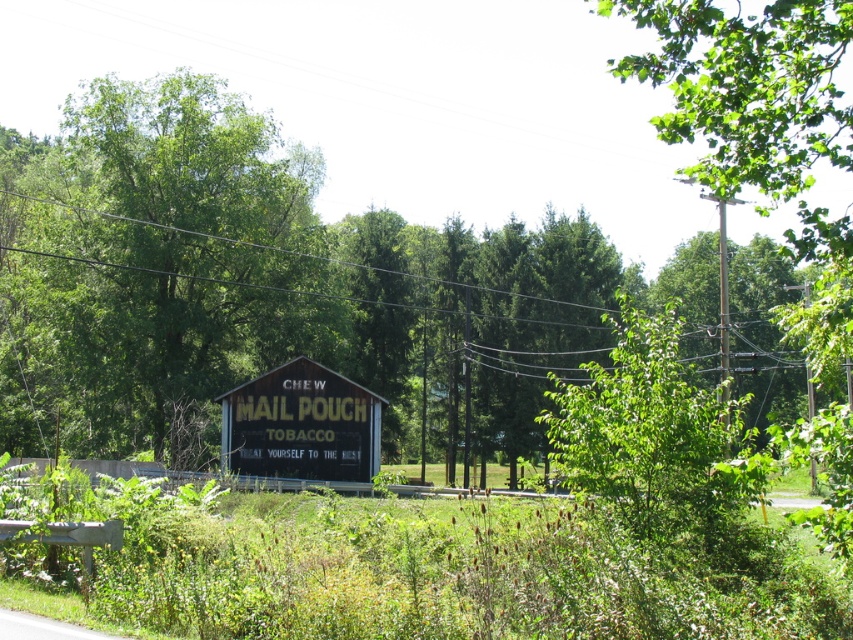
You are standing in a rural area and see the green leafy tree at center and the yellow wooden signboard at center. Which object is bigger?

The green leafy tree at center is larger in size compared to the yellow wooden signboard at center.

You are standing in front of the Mail Pouch Tobacco billboard and notice a green leafy tree at center and a yellow wooden signboard at center. Which object is nearer to you?

The green leafy tree at center is closer to the viewer than the yellow wooden signboard at center.